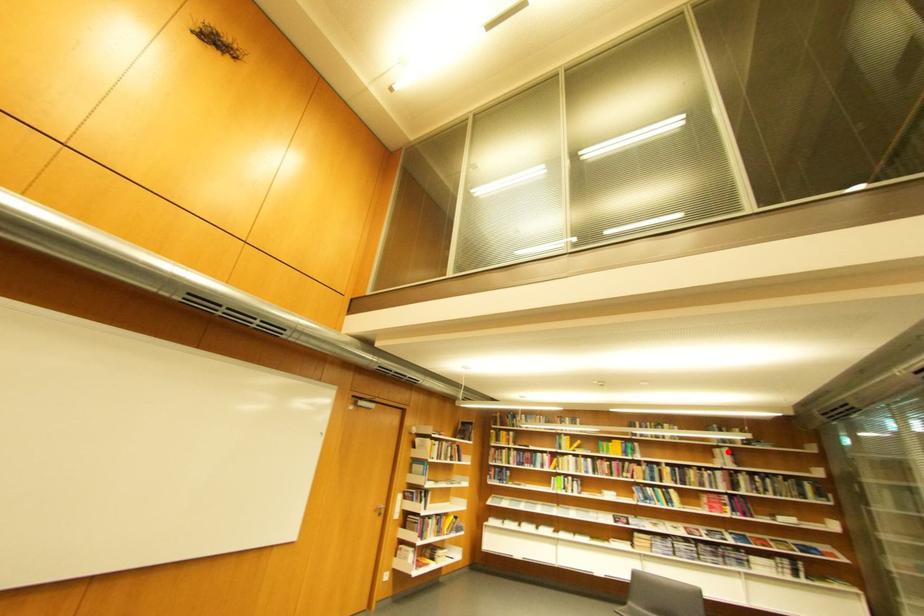
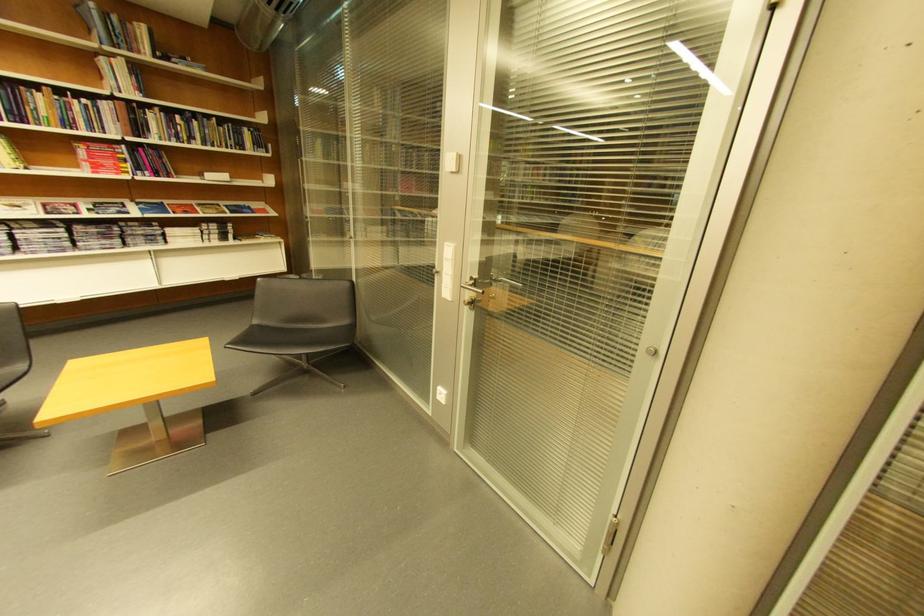
The point at the highlighted location is marked in the first image. Where is the corresponding point in the second image?

(113, 62)